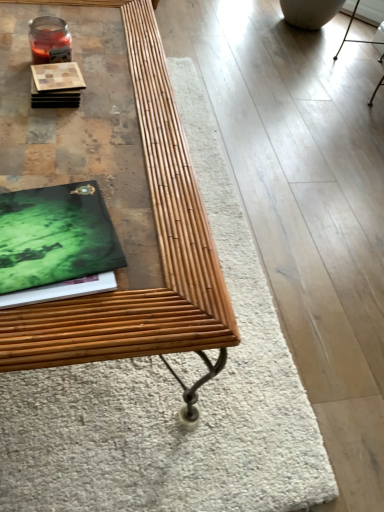
Question: Can you see green matte book at left touching bamboo table at center?

Choices:
 (A) yes
 (B) no

Answer: (B)

Question: Is green matte book at left looking in the opposite direction of bamboo table at center?

Choices:
 (A) no
 (B) yes

Answer: (B)

Question: From the image's perspective, does green matte book at left appear higher than bamboo table at center?

Choices:
 (A) yes
 (B) no

Answer: (B)

Question: Is bamboo table at center located within green matte book at left?

Choices:
 (A) yes
 (B) no

Answer: (B)

Question: Considering the relative sizes of green matte book at left and bamboo table at center in the image provided, is green matte book at left bigger than bamboo table at center?

Choices:
 (A) no
 (B) yes

Answer: (A)

Question: Is green matte book at left smaller than bamboo table at center?

Choices:
 (A) yes
 (B) no

Answer: (A)

Question: From a real-world perspective, is wooden coaster at upper left beneath green matte book at left?

Choices:
 (A) no
 (B) yes

Answer: (A)

Question: Is wooden coaster at upper left at the left side of green matte book at left?

Choices:
 (A) yes
 (B) no

Answer: (A)

Question: Can you confirm if wooden coaster at upper left is thinner than green matte book at left?

Choices:
 (A) no
 (B) yes

Answer: (B)

Question: Would you say green matte book at left is part of wooden coaster at upper left's contents?

Choices:
 (A) no
 (B) yes

Answer: (A)

Question: From a real-world perspective, is wooden coaster at upper left positioned over green matte book at left based on gravity?

Choices:
 (A) yes
 (B) no

Answer: (A)

Question: Considering the relative sizes of wooden coaster at upper left and green matte book at left in the image provided, is wooden coaster at upper left smaller than green matte book at left?

Choices:
 (A) no
 (B) yes

Answer: (B)

Question: Could you tell me if bamboo table at center is facing wooden coaster at upper left?

Choices:
 (A) yes
 (B) no

Answer: (B)